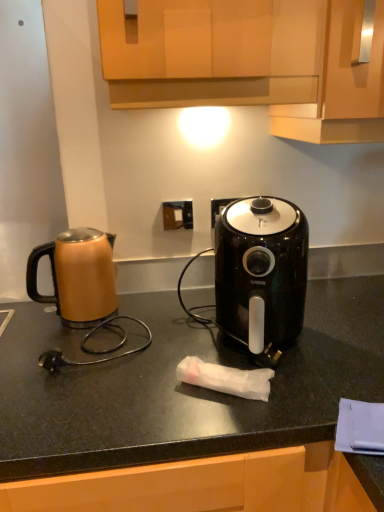
Locate an element on the screen. free spot below matte brown kettle at left (from a real-world perspective) is located at coordinates (77, 324).